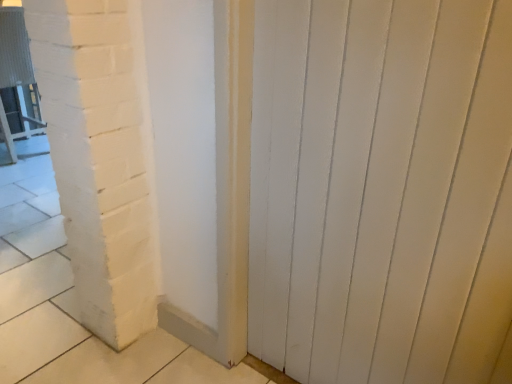
Question: Is metallic silver chair at left in front of or behind white painted wood door at center in the image?

Choices:
 (A) front
 (B) behind

Answer: (B)

Question: Considering the positions of metallic silver chair at left and white painted wood door at center in the image, is metallic silver chair at left taller or shorter than white painted wood door at center?

Choices:
 (A) tall
 (B) short

Answer: (B)

Question: Considering the positions of metallic silver chair at left and white painted wood door at center in the image, is metallic silver chair at left wider or thinner than white painted wood door at center?

Choices:
 (A) thin
 (B) wide

Answer: (B)

Question: From a real-world perspective, relative to metallic silver chair at left, is white painted wood door at center vertically above or below?

Choices:
 (A) above
 (B) below

Answer: (A)

Question: Considering the positions of point (375, 286) and point (38, 94), is point (375, 286) closer or farther from the camera than point (38, 94)?

Choices:
 (A) farther
 (B) closer

Answer: (B)

Question: Would you say white painted wood door at center is to the left or to the right of metallic silver chair at left in the picture?

Choices:
 (A) left
 (B) right

Answer: (B)

Question: Considering the positions of white painted wood door at center and metallic silver chair at left in the image, is white painted wood door at center wider or thinner than metallic silver chair at left?

Choices:
 (A) wide
 (B) thin

Answer: (B)